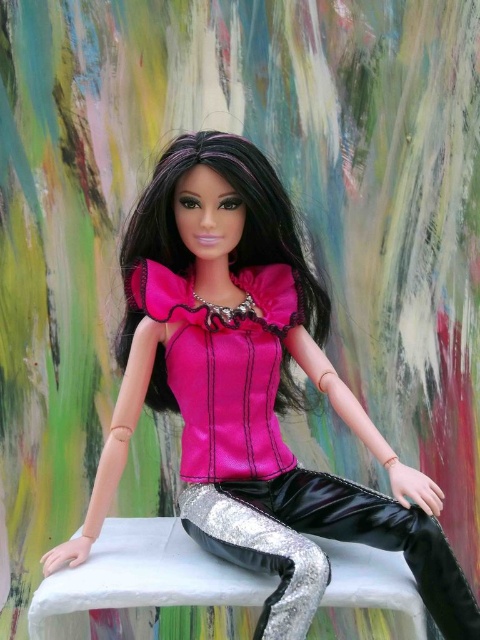
You are an interior designer trying to place a new painting in a room. The painting must be centered exactly at the coordinates given for the satin pink blouse at center. What are the coordinates where you should hang the painting?

The coordinates for the satin pink blouse at center are at point (x=252, y=392), so you should hang the painting at those coordinates.

You are a photographer adjusting your camera. You notice two points in the image, point (455, 592) and point (268, 529). Which point is closer to your camera lens?

Point (455, 592) is further to the camera than point (268, 529), so the closer point to the camera lens is point (268, 529).

You are an interior designer planning to place a decorative pillow on a couch. The couch has limited space, and you need to choose between the satin pink blouse at center and the silver metallic pants at center. Which item would require more space due to its size?

The satin pink blouse at center is larger in size than the silver metallic pants at center, so it would require more space.